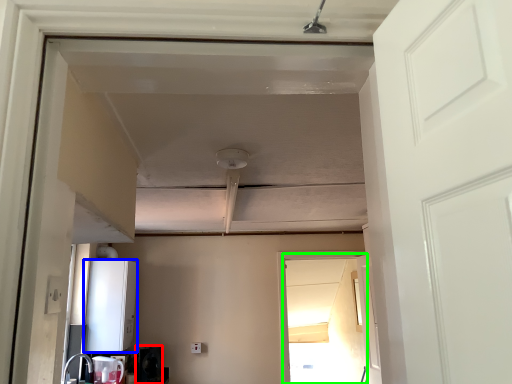
Question: Which is farther away from appliance (highlighted by a red box)? appliance (highlighted by a blue box) or screen door (highlighted by a green box)?

Choices:
 (A) appliance
 (B) screen door

Answer: (B)